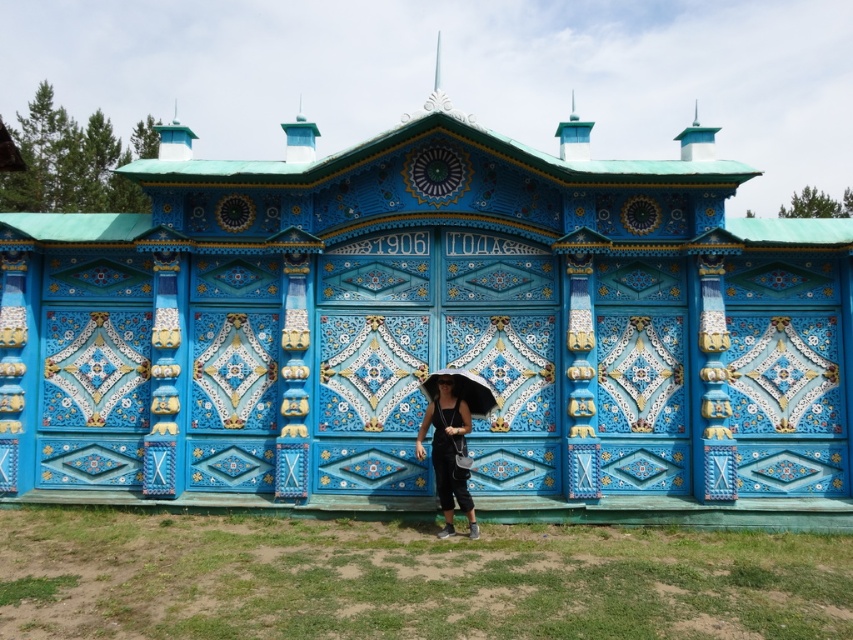
From the picture: You are standing in front of the building and notice two points marked on its facade. The first point is at coordinate point (445, 438) and the second is at point (491, 397). From your perspective, which point appears closer to you?

Point (445, 438) is in front of point (491, 397), so it appears closer to you.

You are standing in front of the building with a bright blue facade. You notice a matte black hat at center. Based on its position coordinates, can you determine if the hat is closer to the top or bottom of the building?

The coordinates of the matte black hat at center are at point 0.697 on the x axis and 0.526 on the y axis. Since the y coordinate is 0.526, which is just above the halfway point of the building, the hat is closer to the bottom of the building.